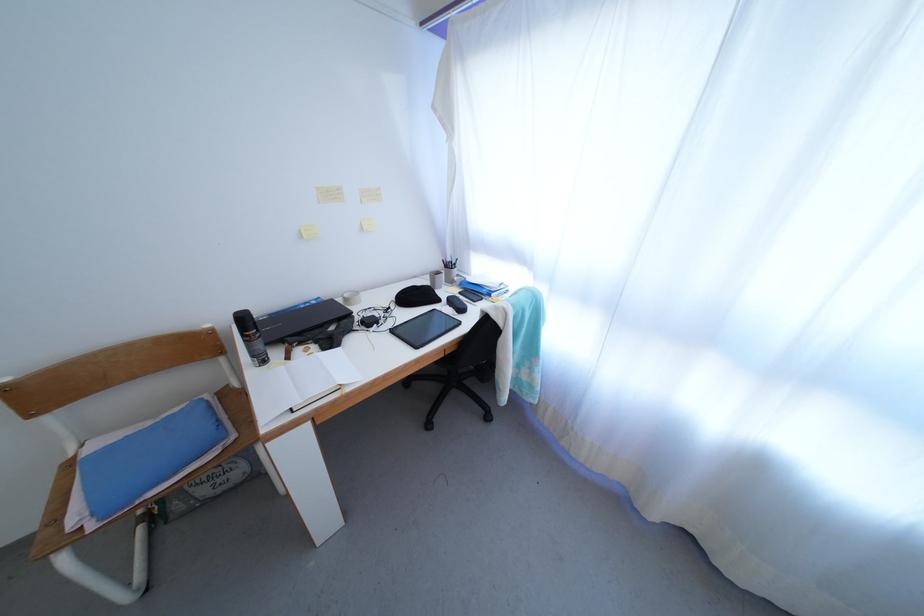
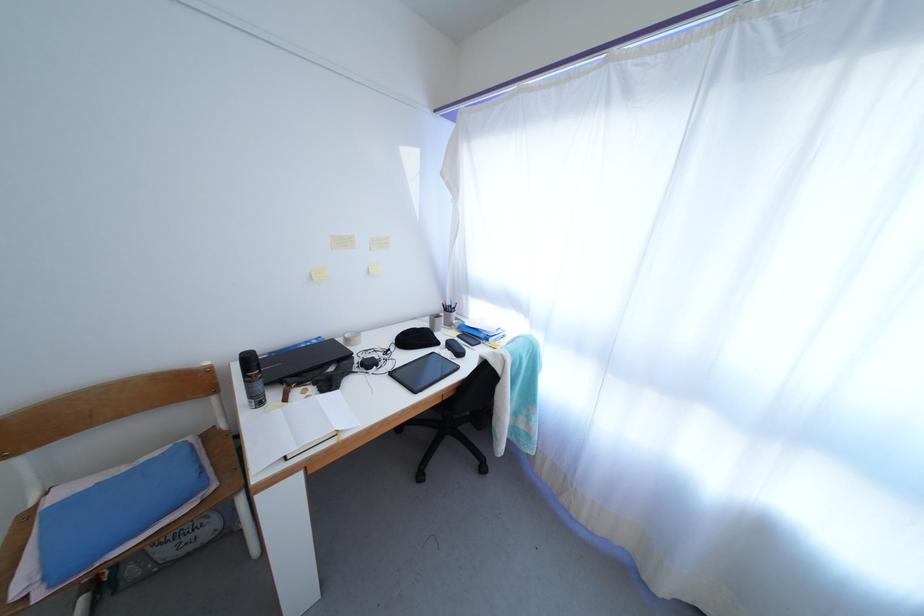
Where in the second image is the point corresponding to pixel 250 347 from the first image?

(250, 387)